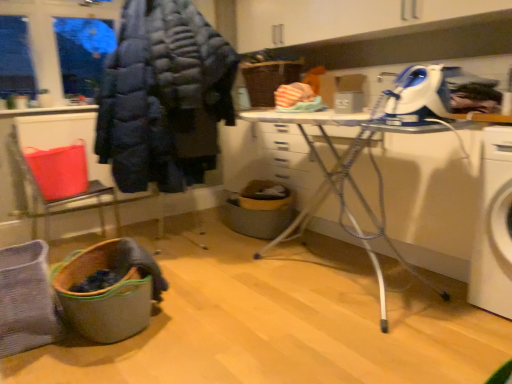
Question: Considering the positions of white plastic ironing board at center and brown woven basket at center in the image, is white plastic ironing board at center wider or thinner than brown woven basket at center?

Choices:
 (A) wide
 (B) thin

Answer: (A)

Question: Is white plastic ironing board at center bigger or smaller than brown woven basket at center?

Choices:
 (A) small
 (B) big

Answer: (B)

Question: Estimate the real-world distances between objects in this image. Which object is closer to the brown woven basket at center?

Choices:
 (A) dark blue puffer jacket at upper left
 (B) matte plastic chair at lower left
 (C) white plastic ironing board at center
 (D) blue plastic iron at upper right
 (E) wooden laundry basket at lower left

Answer: (C)

Question: Based on their relative distances, which object is nearer to the white plastic ironing board at center?

Choices:
 (A) wooden laundry basket at lower left
 (B) blue plastic iron at upper right
 (C) brown woven basket at center
 (D) matte plastic chair at lower left
 (E) dark blue puffer jacket at upper left

Answer: (C)